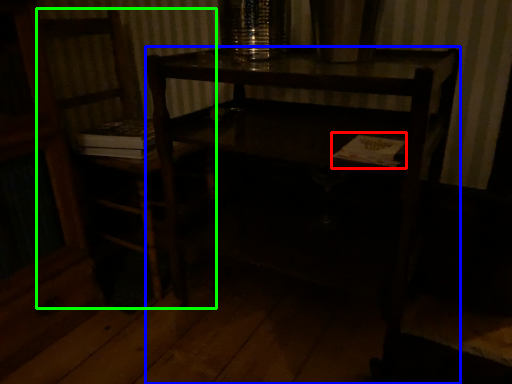
Question: Which object is positioned closest to book (highlighted by a red box)? Select from desk (highlighted by a blue box) and chair (highlighted by a green box).

Choices:
 (A) desk
 (B) chair

Answer: (A)